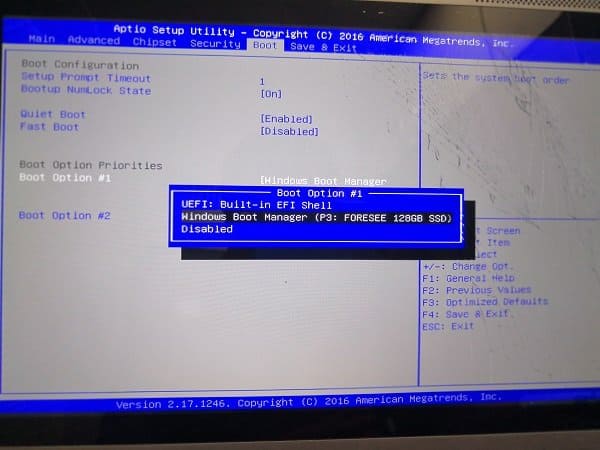
Where is `monitor screen`? monitor screen is located at coordinates (160, 297).